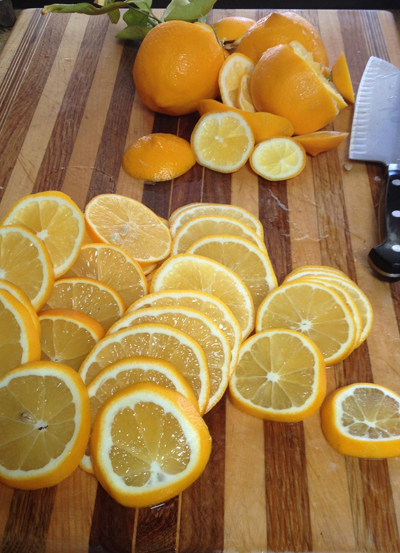
What are the coordinates of `cutting board` in the screenshot? It's located at (233, 495).